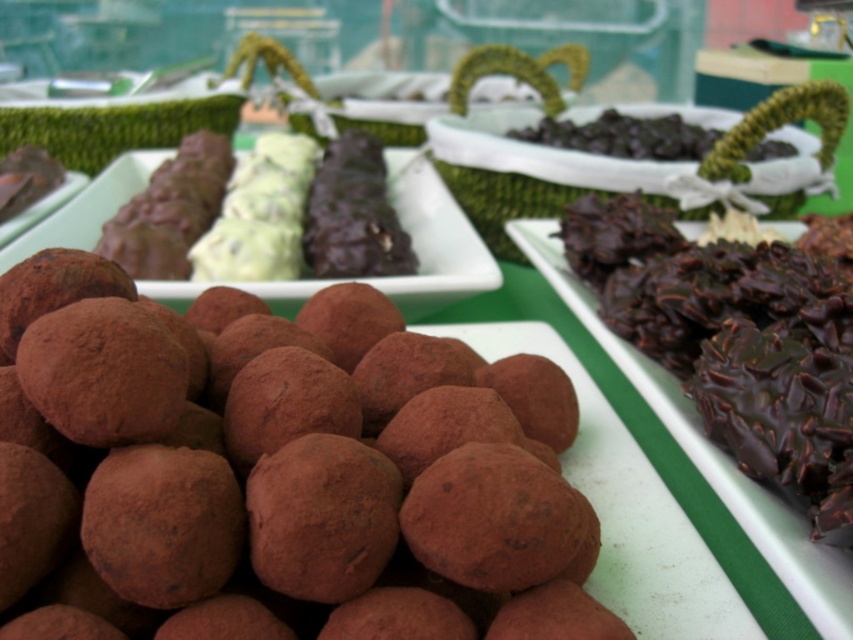
From the picture: You are standing in front of a display of chocolate confections. You see two points labeled as point (x=22, y=381) and point (x=711, y=320). Which point is closer to you?

Point (x=22, y=381) is in front of point (x=711, y=320), so it is closer to you.

You are standing in front of a display of chocolate confections. You see a point labeled as point (x=277, y=472). Which chocolate confection is this point located on?

The point (x=277, y=472) is located on the brown matte truffles at lower left.